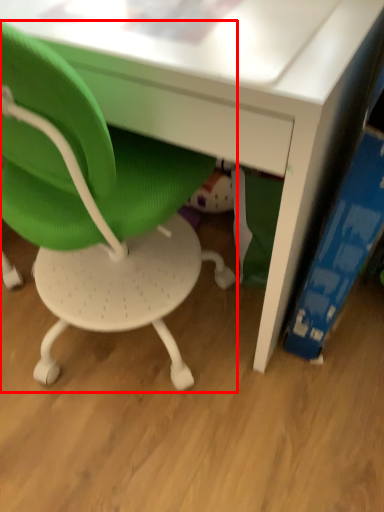
Question: Observing the image, what is the correct spatial positioning of chair (annotated by the red box) in reference to paperback book?

Choices:
 (A) right
 (B) left

Answer: (B)